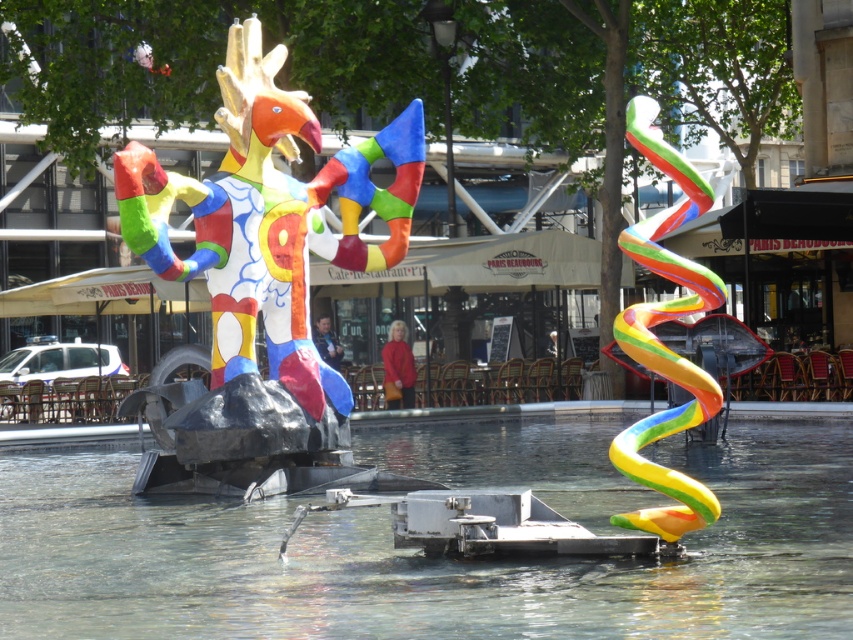
Who is more distant from viewer, (321,426) or (689,392)?

The point (321,426) is behind.

Can you confirm if multicolored painted sculpture at center is bigger than rainbow rubber spiral at right?

No, multicolored painted sculpture at center is not bigger than rainbow rubber spiral at right.

Between point (349, 212) and point (631, 145), which one is positioned in front?

Point (349, 212) is in front.

Find the location of a particular element. The image size is (853, 640). multicolored painted sculpture at center is located at coordinates (264, 280).

Between clear glass water at center and rainbow rubber spiral at right, which one is positioned lower?

clear glass water at center

Who is positioned more to the right, clear glass water at center or rainbow rubber spiral at right?

Positioned to the right is rainbow rubber spiral at right.

Is point (438, 449) farther from viewer compared to point (704, 488)?

Yes.

I want to click on clear glass water at center, so click(x=424, y=557).

Can you confirm if clear glass water at center is positioned below multicolored painted sculpture at center?

Indeed, clear glass water at center is positioned under multicolored painted sculpture at center.

Does point (383, 440) come farther from viewer compared to point (345, 444)?

Yes, it is behind point (345, 444).

Locate an element on the screen. This screenshot has width=853, height=640. clear glass water at center is located at coordinates (424, 557).